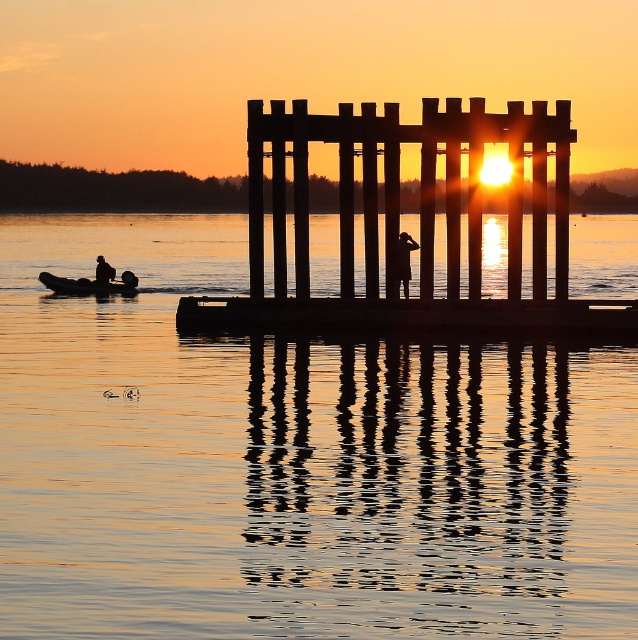
Question: Can you confirm if rubber boat at left is smaller than silhouette figure at center?

Choices:
 (A) no
 (B) yes

Answer: (A)

Question: Which of the following is the closest to the observer?

Choices:
 (A) (110, 284)
 (B) (52, 536)
 (C) (371, 189)

Answer: (B)

Question: Among these points, which one is farthest from the camera?

Choices:
 (A) (359, 125)
 (B) (128, 282)
 (C) (334, 570)
 (D) (390, 262)

Answer: (B)

Question: Does smooth water at center appear on the right side of wooden at center?

Choices:
 (A) no
 (B) yes

Answer: (B)

Question: Among these points, which one is nearest to the camera?

Choices:
 (A) (100, 284)
 (B) (531, 192)
 (C) (100, 280)
 (D) (22, 621)

Answer: (D)

Question: Is wooden at center thinner than rubber boat at left?

Choices:
 (A) no
 (B) yes

Answer: (A)